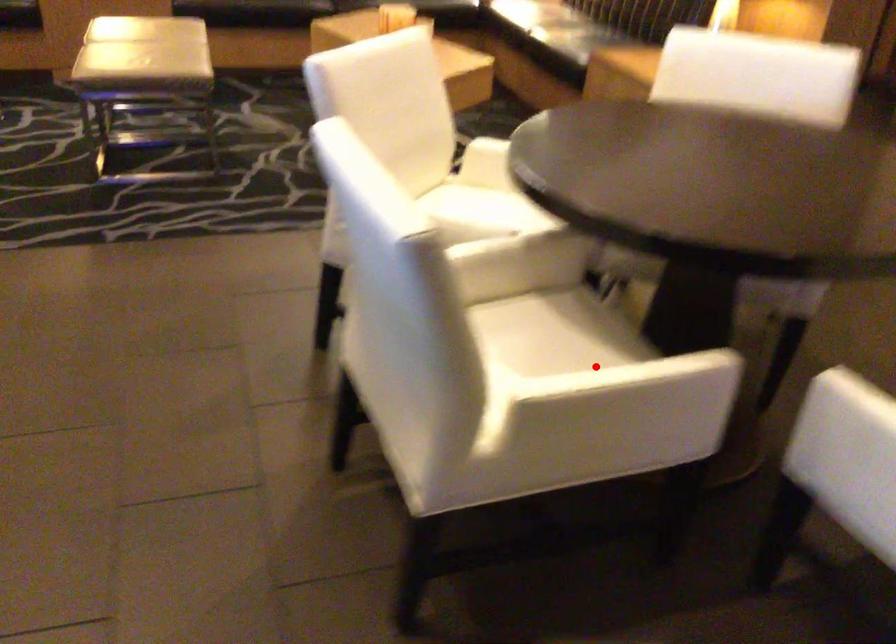
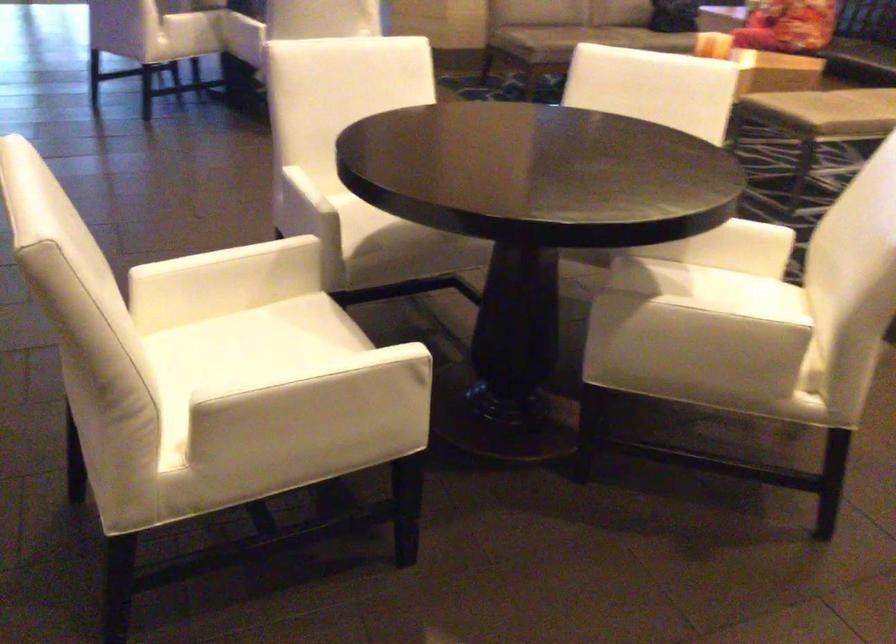
Question: I am providing you with two images of the same scene from different viewpoints. A red point is shown in image1. For the corresponding object point in image2, is it positioned nearer or farther from the camera?

Choices:
 (A) Nearer
 (B) Farther

Answer: (B)